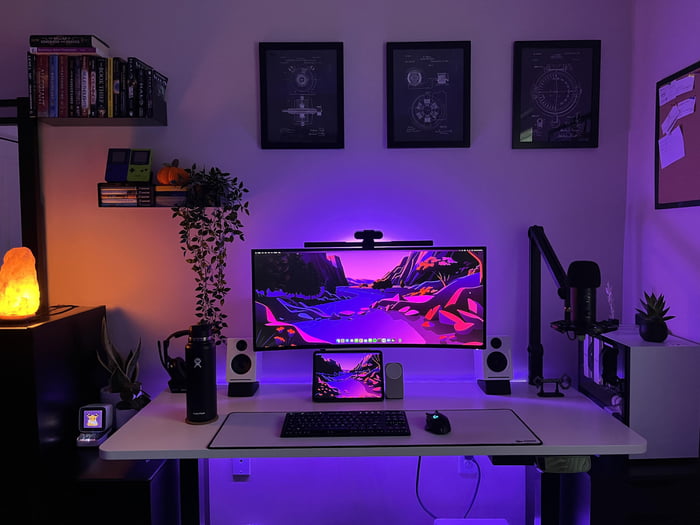
You are a GUI agent. You are given a task and a screenshot of the screen. Output one action in this format:
    pyautogui.click(x=<x>, y=<y>)
    Task: Click on the rock salt lamp
    This screenshot has height=525, width=700.
    Given the screenshot: What is the action you would take?
    [20, 296]